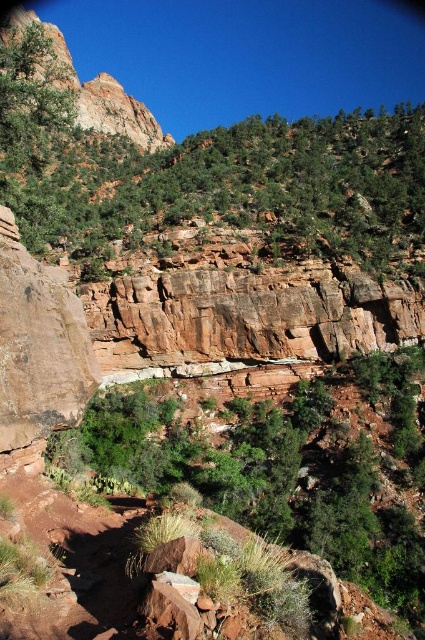
Is point (286, 218) farther from viewer compared to point (17, 26)?

That is False.

Who is shorter, green leafy trees at upper center or rustic rock formation at upper left?

green leafy trees at upper center

Who is more distant from viewer, (240, 125) or (118, 108)?

Positioned behind is point (118, 108).

Locate an element on the screen. green leafy trees at upper center is located at coordinates (226, 184).

Which is behind, point (246, 481) or point (82, 124)?

Positioned behind is point (82, 124).

Which is behind, point (217, 474) or point (110, 132)?

Point (110, 132)

Locate an element on the screen. green leafy shrubs at center is located at coordinates (291, 467).

Which is below, green leafy trees at upper center or green leafy shrubs at center?

green leafy shrubs at center is below.

Measure the distance between green leafy trees at upper center and camera.

green leafy trees at upper center and camera are 52.65 meters apart from each other.

The image size is (425, 640). Find the location of `green leafy trees at upper center`. green leafy trees at upper center is located at coordinates (x=226, y=184).